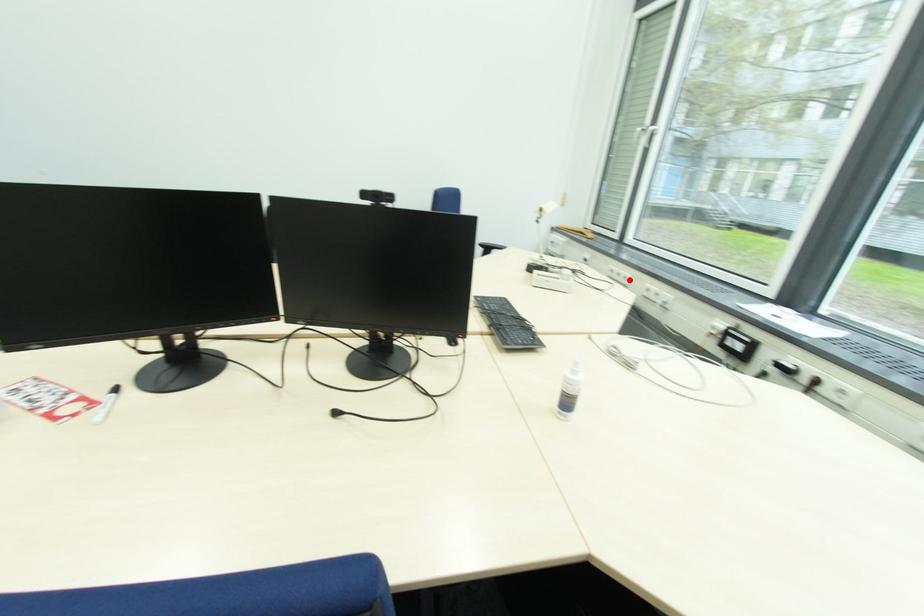
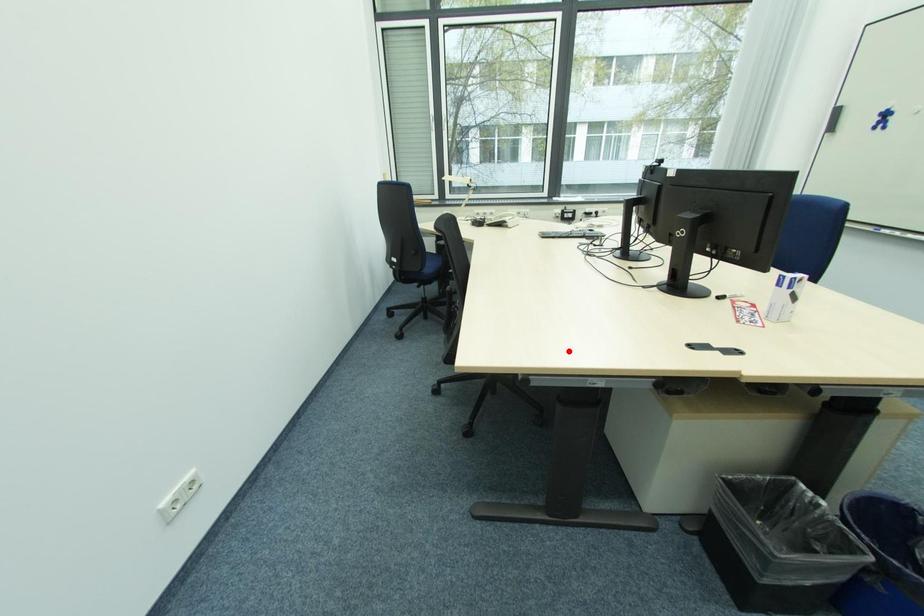
I am providing you with two images of the same scene from different viewpoints. A red point is marked on the first image and another point is marked on the second image. Is the red point in image1 aligned with the point shown in image2?

No